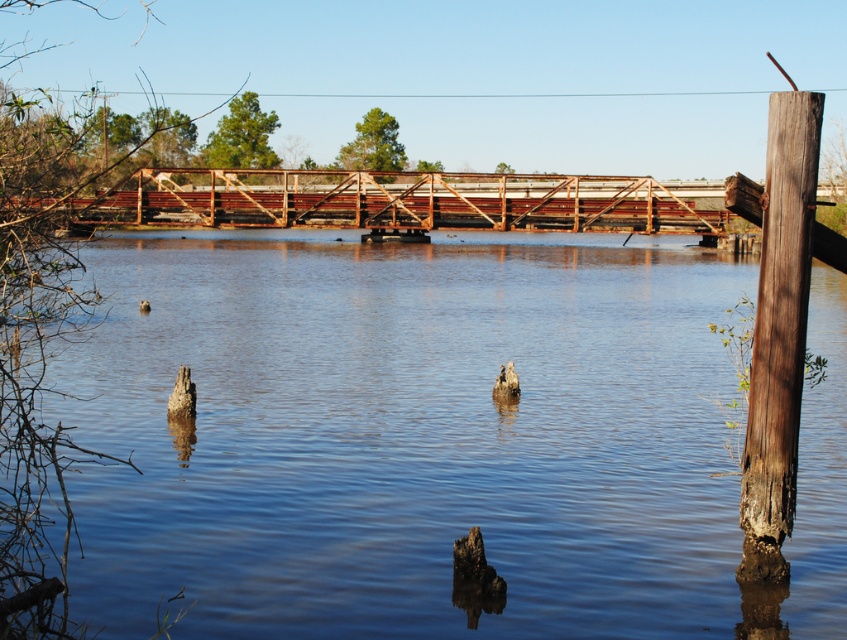
You are a photographer trying to capture the brown fuzzy duck at center in your shot. The blue water at center is obstructing your view. Can you adjust your camera angle to see the duck clearly?

The blue water at center is taller than brown fuzzy duck at center, so adjusting the camera angle downward might allow you to see the duck clearly by looking under the water level.